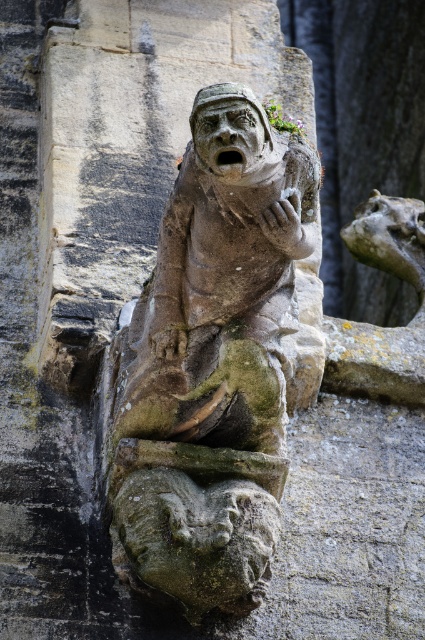
You are an architect analyzing the positioning of two points on the gargoyle sculpture. The first point is at coordinate point (215, 195) and the second is at point (226, 132). From the viewer perspective, which point is closer to you?

Point (226, 132) is closer to the viewer because it is in front of point (215, 195) according to the spatial description provided.

You are an architect examining the exterior wall of a cathedral. You notice the stone gargoyle at center and the matte stone face at center. Which object is wider?

The stone gargoyle at center is wider than the matte stone face at center because its width surpasses the latter.

You are an architect inspecting the building facade. You notice the stone gargoyle at center and the matte stone face at center. Which one is positioned lower on the building?

The stone gargoyle at center is positioned below the matte stone face at center, so the stone gargoyle at center is lower on the building.